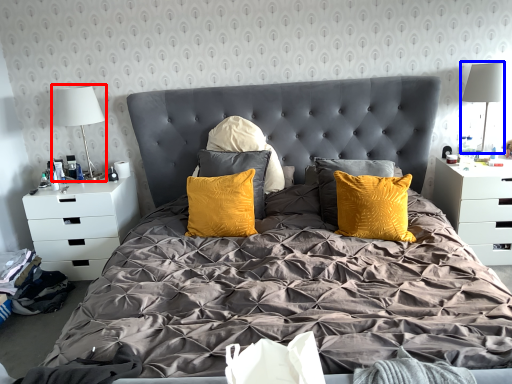
Question: Which of the following is the farthest to the observer, table lamp (highlighted by a red box) or table lamp (highlighted by a blue box)?

Choices:
 (A) table lamp
 (B) table lamp

Answer: (A)